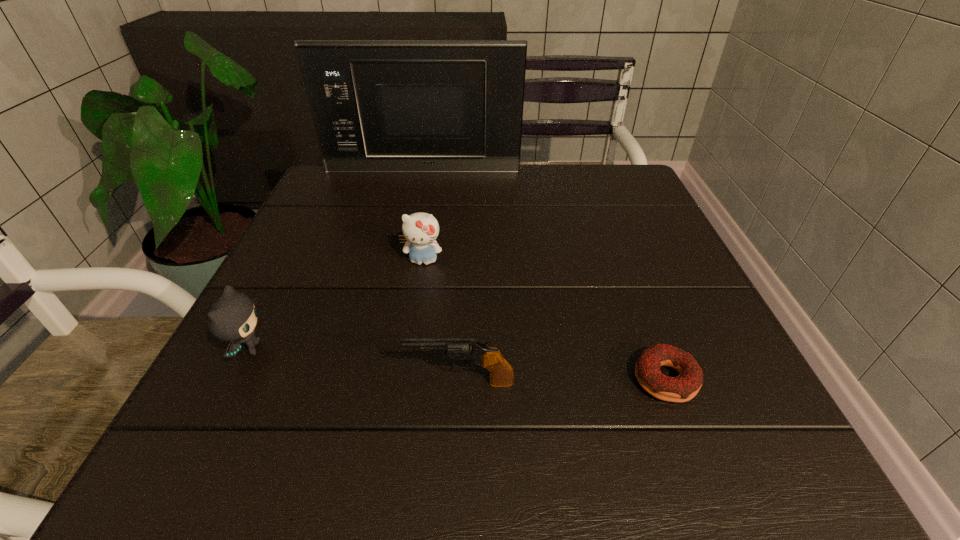
Find the location of a particular element. The width and height of the screenshot is (960, 540). vacant area at the far edge is located at coordinates (573, 206).

In the image, there is a desktop. Identify the location of vacant region at the left edge. The image size is (960, 540). (288, 282).

The height and width of the screenshot is (540, 960). I want to click on vacant space at the right edge of the desktop, so click(x=682, y=259).

Image resolution: width=960 pixels, height=540 pixels. I want to click on free space at the far left corner of the desktop, so click(353, 176).

Image resolution: width=960 pixels, height=540 pixels. Identify the location of vacant area that lies between the doughnut and the gun. (563, 381).

Identify the location of free space between the nearer kitten and the farthest object. [x=336, y=260].

Image resolution: width=960 pixels, height=540 pixels. I want to click on free space between the gun and the shortest object, so click(x=563, y=381).

Image resolution: width=960 pixels, height=540 pixels. In order to click on vacant area that lies between the nearer kitten and the gun in this screenshot , I will do `click(354, 366)`.

Where is `vacant point located between the nearer kitten and the second farthest object`? This screenshot has width=960, height=540. vacant point located between the nearer kitten and the second farthest object is located at coordinates (336, 305).

This screenshot has width=960, height=540. I want to click on vacant area that lies between the rightmost object and the farther kitten, so click(544, 320).